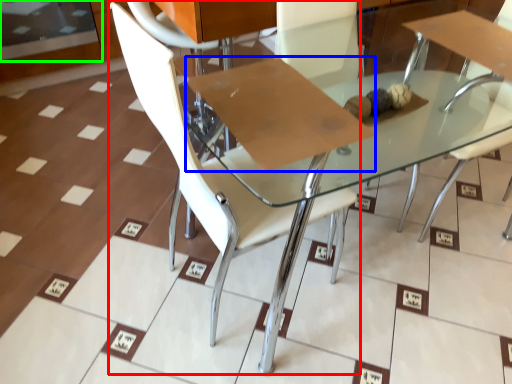
Question: Which object is the farthest from chair (highlighted by a red box)? Choose among these: cardboard (highlighted by a blue box) or glass door (highlighted by a green box).

Choices:
 (A) cardboard
 (B) glass door

Answer: (B)